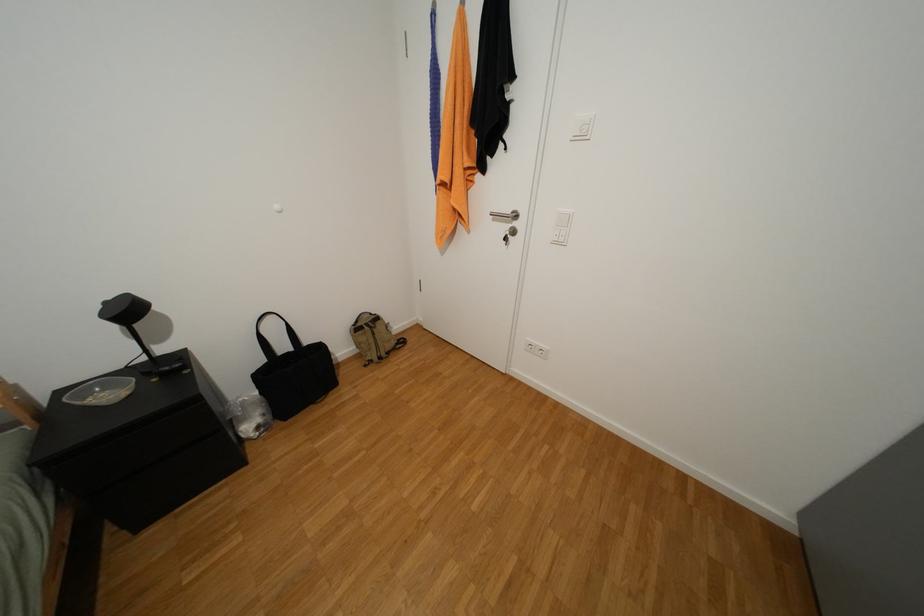
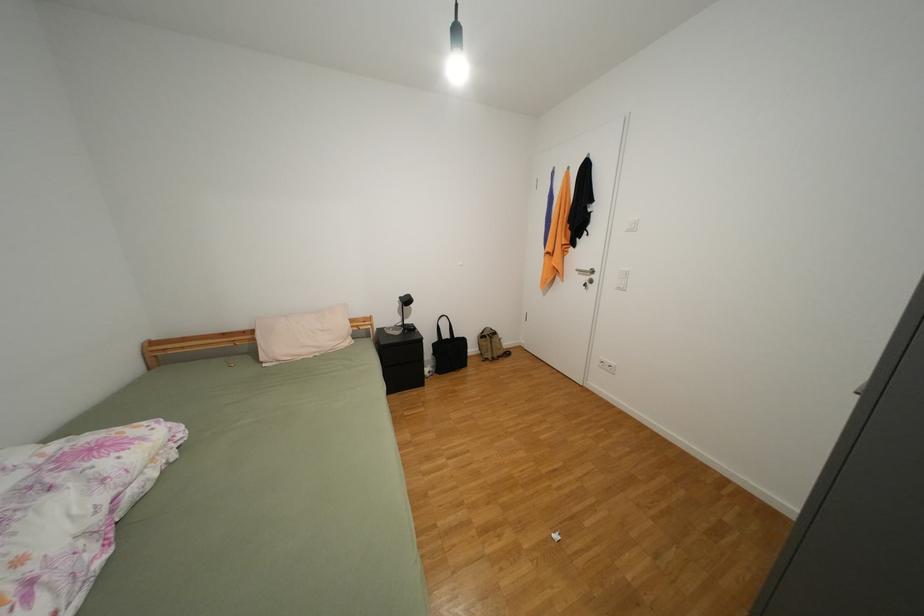
Question: The camera is either moving clockwise (left) or counter-clockwise (right) around the object. The first image is from the beginning of the video and the second image is from the end. Is the camera moving left or right when shooting the video?

Choices:
 (A) Left
 (B) Right

Answer: (B)